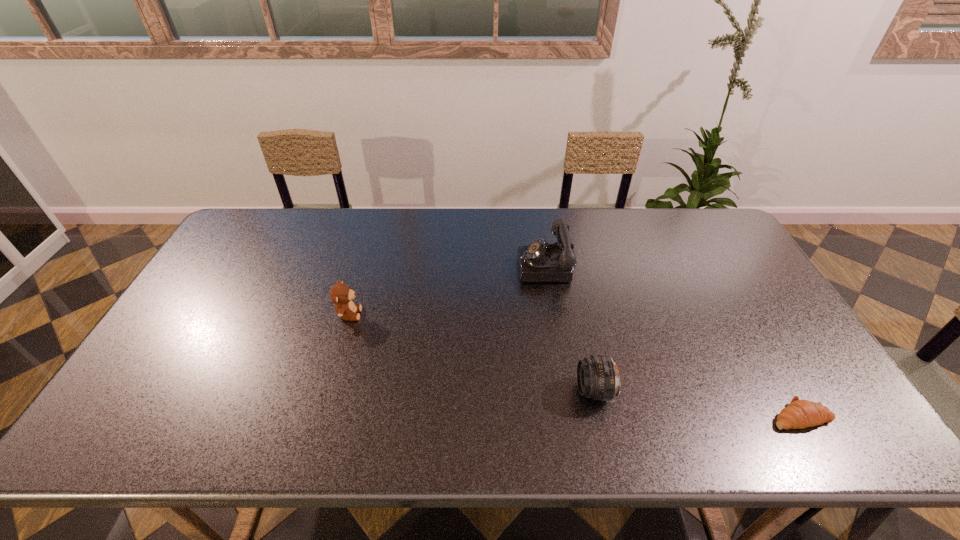
Identify the location of blank space at the near edge of the desktop. (780, 438).

I want to click on vacant space at the left edge, so click(x=198, y=294).

Locate an element on the screen. free space at the right edge of the desktop is located at coordinates (752, 283).

Where is `vacant region at the far left corner`? The image size is (960, 540). vacant region at the far left corner is located at coordinates (262, 239).

Locate an element on the screen. The height and width of the screenshot is (540, 960). blank region between the farthest object and the leftmost object is located at coordinates (448, 290).

Where is `free space between the leftmost object and the rightmost object`? This screenshot has height=540, width=960. free space between the leftmost object and the rightmost object is located at coordinates (575, 365).

Where is `vacant region between the telephoto lens and the third nearest object`? The width and height of the screenshot is (960, 540). vacant region between the telephoto lens and the third nearest object is located at coordinates (471, 352).

What are the coordinates of `free space between the telephoto lens and the rightmost object` in the screenshot? It's located at (698, 403).

Find the location of `blank region between the telephoto lens and the rightmost object`. blank region between the telephoto lens and the rightmost object is located at coordinates (698, 403).

Identify the location of vacant space that's between the teddy bear and the crescent roll. The image size is (960, 540). (575, 365).